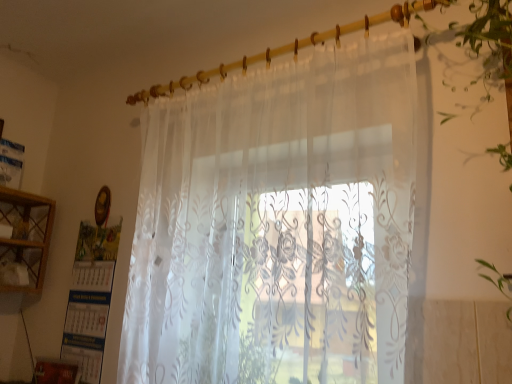
Question: Is translucent floral-patterned curtain at center in front of translucent floral curtain at right?

Choices:
 (A) no
 (B) yes

Answer: (A)

Question: Is translucent floral curtain at right completely or partially inside translucent floral-patterned curtain at center?

Choices:
 (A) no
 (B) yes

Answer: (A)

Question: Can you confirm if translucent floral-patterned curtain at center is shorter than translucent floral curtain at right?

Choices:
 (A) yes
 (B) no

Answer: (B)

Question: From a real-world perspective, is translucent floral-patterned curtain at center positioned under translucent floral curtain at right based on gravity?

Choices:
 (A) no
 (B) yes

Answer: (B)

Question: Considering the relative positions of translucent floral-patterned curtain at center and translucent floral curtain at right in the image provided, is translucent floral-patterned curtain at center behind translucent floral curtain at right?

Choices:
 (A) no
 (B) yes

Answer: (B)

Question: Is translucent floral-patterned curtain at center placed right next to translucent floral curtain at right?

Choices:
 (A) no
 (B) yes

Answer: (A)

Question: Can you confirm if translucent floral curtain at right is thinner than wooden cabinet at left?

Choices:
 (A) no
 (B) yes

Answer: (A)

Question: From the image's perspective, would you say translucent floral curtain at right is positioned over wooden cabinet at left?

Choices:
 (A) yes
 (B) no

Answer: (A)

Question: From a real-world perspective, does translucent floral curtain at right sit lower than wooden cabinet at left?

Choices:
 (A) yes
 (B) no

Answer: (B)

Question: Is translucent floral curtain at right positioned behind wooden cabinet at left?

Choices:
 (A) yes
 (B) no

Answer: (B)

Question: Is translucent floral curtain at right far away from wooden cabinet at left?

Choices:
 (A) yes
 (B) no

Answer: (A)

Question: Would you say translucent floral curtain at right contains wooden cabinet at left?

Choices:
 (A) yes
 (B) no

Answer: (B)

Question: Can you confirm if translucent floral-patterned curtain at center is wider than wooden cabinet at left?

Choices:
 (A) yes
 (B) no

Answer: (B)